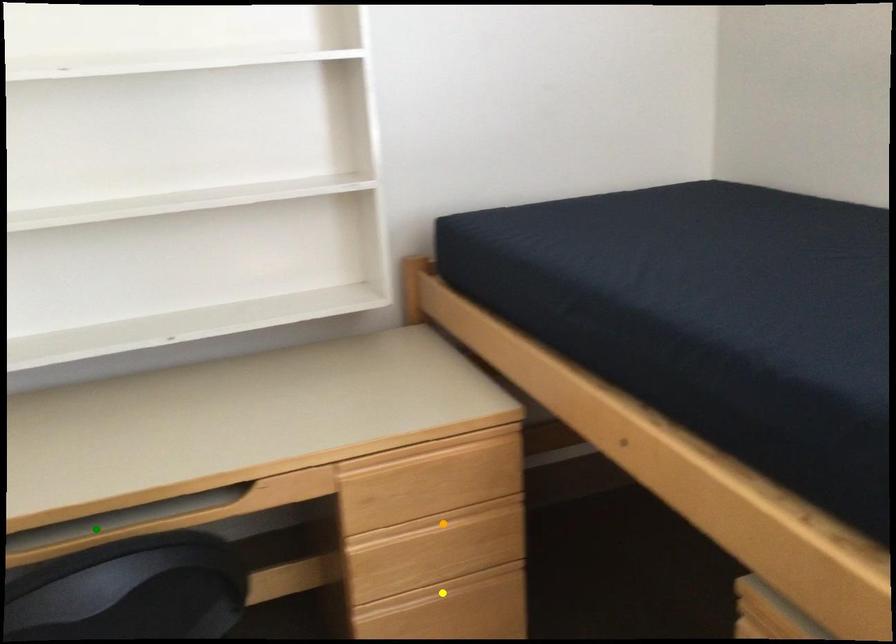
Order these from farthest to nearest:
1. green point
2. orange point
3. yellow point

yellow point → orange point → green point